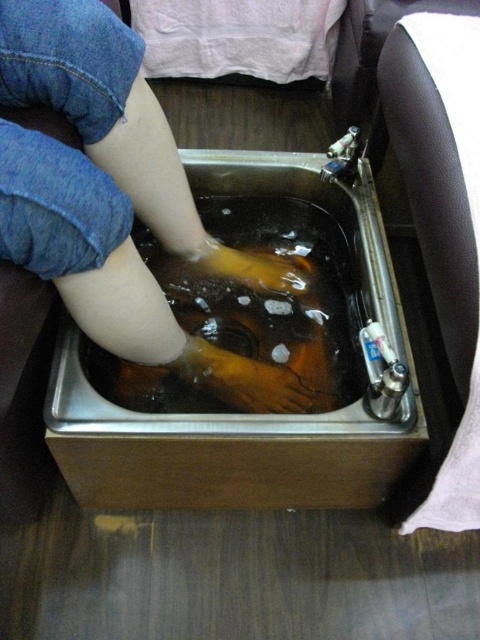
Question: Which is farther from the stainless steel sink at center?

Choices:
 (A) smooth skin hand at center
 (B) yellow rubber glove at center

Answer: (B)

Question: Considering the real-world distances, which object is farthest from the smooth skin hand at center?

Choices:
 (A) yellow rubber glove at center
 (B) stainless steel sink at center

Answer: (A)

Question: Which of these objects is positioned closest to the stainless steel sink at center?

Choices:
 (A) smooth skin hand at center
 (B) yellow rubber glove at center

Answer: (A)

Question: Is stainless steel sink at center below smooth skin hand at center?

Choices:
 (A) yes
 (B) no

Answer: (B)

Question: Is smooth skin hand at center further to camera compared to yellow rubber glove at center?

Choices:
 (A) no
 (B) yes

Answer: (A)

Question: Can you confirm if stainless steel sink at center is thinner than smooth skin hand at center?

Choices:
 (A) yes
 (B) no

Answer: (B)